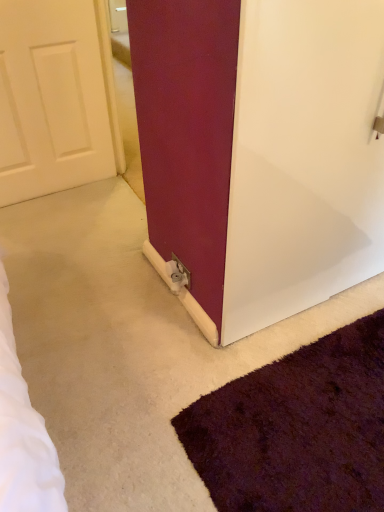
Measure the distance between point (187, 270) and camera.

Point (187, 270) and camera are 1.59 meters apart.

Where is `metallic silver outlet at lower center`? metallic silver outlet at lower center is located at coordinates (177, 274).

Describe the element at coordinates (177, 274) in the screenshot. The width and height of the screenshot is (384, 512). I see `metallic silver outlet at lower center` at that location.

This screenshot has height=512, width=384. What do you see at coordinates (261, 148) in the screenshot?
I see `matte white door at center` at bounding box center [261, 148].

Locate an element on the screen. The image size is (384, 512). matte white door at center is located at coordinates (261, 148).

Where is `metallic silver outlet at lower center`? This screenshot has width=384, height=512. metallic silver outlet at lower center is located at coordinates (177, 274).

Would you say metallic silver outlet at lower center is to the left or to the right of matte white door at center in the picture?

Clearly, metallic silver outlet at lower center is on the left of matte white door at center in the image.

Is metallic silver outlet at lower center closer to the viewer compared to matte white door at center?

No, it is behind matte white door at center.

Does point (188, 278) lie behind point (325, 82)?

Yes, point (188, 278) is behind point (325, 82).

From the image's perspective, between metallic silver outlet at lower center and matte white door at center, which one is located above?

From the image's view, matte white door at center is above.

From a real-world perspective, relative to matte white door at center, is metallic silver outlet at lower center vertically above or below?

Clearly, from a real-world perspective, metallic silver outlet at lower center is below matte white door at center.

Which of these two, metallic silver outlet at lower center or matte white door at center, is thinner?

With smaller width is metallic silver outlet at lower center.

Is metallic silver outlet at lower center taller than matte white door at center?

No.

Can you confirm if metallic silver outlet at lower center is bigger than matte white door at center?

No.

Is metallic silver outlet at lower center located outside matte white door at center?

Yes, metallic silver outlet at lower center is outside of matte white door at center.

Are metallic silver outlet at lower center and matte white door at center far apart?

They are positioned close to each other.

In the scene shown: Is metallic silver outlet at lower center positioned with its back to matte white door at center?

Yes, metallic silver outlet at lower center is positioned with its back facing matte white door at center.

Can you tell me how much metallic silver outlet at lower center and matte white door at center differ in facing direction?

metallic silver outlet at lower center and matte white door at center are facing 90.8 degrees away from each other.

Locate an element on the screen. door in front of the metallic silver outlet at lower center is located at coordinates (261, 148).

Based on their positions, is matte white door at center located to the left or right of metallic silver outlet at lower center?

In the image, matte white door at center appears on the right side of metallic silver outlet at lower center.

Is matte white door at center in front of or behind metallic silver outlet at lower center in the image?

Clearly, matte white door at center is in front of metallic silver outlet at lower center.

Considering the points (172, 113) and (185, 276), which point is behind, point (172, 113) or point (185, 276)?

The point (185, 276) is farther.

From the image's perspective, which one is positioned lower, matte white door at center or metallic silver outlet at lower center?

metallic silver outlet at lower center is shown below in the image.

From a real-world perspective, which is physically above, matte white door at center or metallic silver outlet at lower center?

In real-world perspective, matte white door at center is above.

Which object is thinner, matte white door at center or metallic silver outlet at lower center?

metallic silver outlet at lower center is thinner.

Is matte white door at center taller or shorter than metallic silver outlet at lower center?

Considering their sizes, matte white door at center has more height than metallic silver outlet at lower center.

Considering the relative sizes of matte white door at center and metallic silver outlet at lower center in the image provided, is matte white door at center smaller than metallic silver outlet at lower center?

Actually, matte white door at center might be larger than metallic silver outlet at lower center.

Do you think matte white door at center is within metallic silver outlet at lower center, or outside of it?

matte white door at center is located beyond the bounds of metallic silver outlet at lower center.

Is matte white door at center next to metallic silver outlet at lower center?

They are not placed beside each other.

Is metallic silver outlet at lower center at the back of matte white door at center?

No, matte white door at center's orientation is not away from metallic silver outlet at lower center.

Can you tell me how much matte white door at center and metallic silver outlet at lower center differ in facing direction?

The angle between the facing direction of matte white door at center and the facing direction of metallic silver outlet at lower center is 90.8 degrees.

The height and width of the screenshot is (512, 384). I want to click on door above the metallic silver outlet at lower center (from a real-world perspective), so click(261, 148).

What are the coordinates of `door positioned vertically above the metallic silver outlet at lower center (from a real-world perspective)` in the screenshot? It's located at (261, 148).

You are a GUI agent. You are given a task and a screenshot of the screen. Output one action in this format:
    pyautogui.click(x=<x>, y=<y>)
    Task: Click on the electric outlet behind the matte white door at center
    
    Given the screenshot: What is the action you would take?
    pyautogui.click(x=177, y=274)